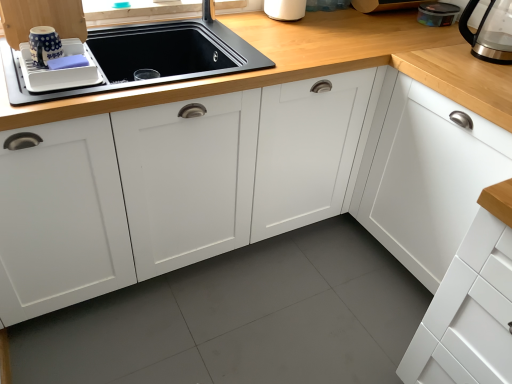
Question: Considering the relative sizes of transparent glass coffeepot at upper right and white glossy tray at upper left, the first cabinetry when ordered from left to right, in the image provided, is transparent glass coffeepot at upper right smaller than white glossy tray at upper left, the first cabinetry when ordered from left to right,?

Choices:
 (A) no
 (B) yes

Answer: (A)

Question: Does transparent glass coffeepot at upper right appear on the right side of white glossy tray at upper left, the first cabinetry when ordered from left to right?

Choices:
 (A) yes
 (B) no

Answer: (A)

Question: From the image's perspective, is transparent glass coffeepot at upper right over white glossy tray at upper left, the first cabinetry when ordered from left to right?

Choices:
 (A) no
 (B) yes

Answer: (A)

Question: Is transparent glass coffeepot at upper right positioned with its back to white glossy tray at upper left, which is the third cabinetry in right-to-left order?

Choices:
 (A) yes
 (B) no

Answer: (B)

Question: From a real-world perspective, is transparent glass coffeepot at upper right positioned under white glossy tray at upper left, the first cabinetry when ordered from left to right, based on gravity?

Choices:
 (A) no
 (B) yes

Answer: (B)

Question: Is transparent glass coffeepot at upper right aimed at white glossy tray at upper left, the first cabinetry when ordered from left to right?

Choices:
 (A) yes
 (B) no

Answer: (A)

Question: Could transparent plastic container at upper right, the fourth appliance when ordered from left to right, be considered to be inside white plastic dish drainer at upper left, the 4th appliance from the back?

Choices:
 (A) yes
 (B) no

Answer: (B)

Question: Is white plastic dish drainer at upper left, which is the 4th appliance from right to left, positioned beyond the bounds of transparent plastic container at upper right, which is the third appliance from front to back?

Choices:
 (A) yes
 (B) no

Answer: (A)

Question: Does white plastic dish drainer at upper left, the first appliance viewed from the left, have a lesser height compared to transparent plastic container at upper right, the second appliance viewed from the back?

Choices:
 (A) no
 (B) yes

Answer: (A)

Question: From the image's perspective, is white plastic dish drainer at upper left, the first appliance viewed from the left, under transparent plastic container at upper right, which ranks as the first appliance in right-to-left order?

Choices:
 (A) yes
 (B) no

Answer: (A)

Question: From the image's perspective, is white plastic dish drainer at upper left, the 4th appliance from the back, on top of transparent plastic container at upper right, which ranks as the first appliance in right-to-left order?

Choices:
 (A) no
 (B) yes

Answer: (A)

Question: Is white plastic dish drainer at upper left, the first appliance viewed from the left, at the right side of transparent plastic container at upper right, the fourth appliance when ordered from left to right?

Choices:
 (A) no
 (B) yes

Answer: (A)

Question: Is white plastic dish drainer at upper left, the first appliance viewed from the left, taller than transparent glass coffeepot at upper right?

Choices:
 (A) no
 (B) yes

Answer: (A)